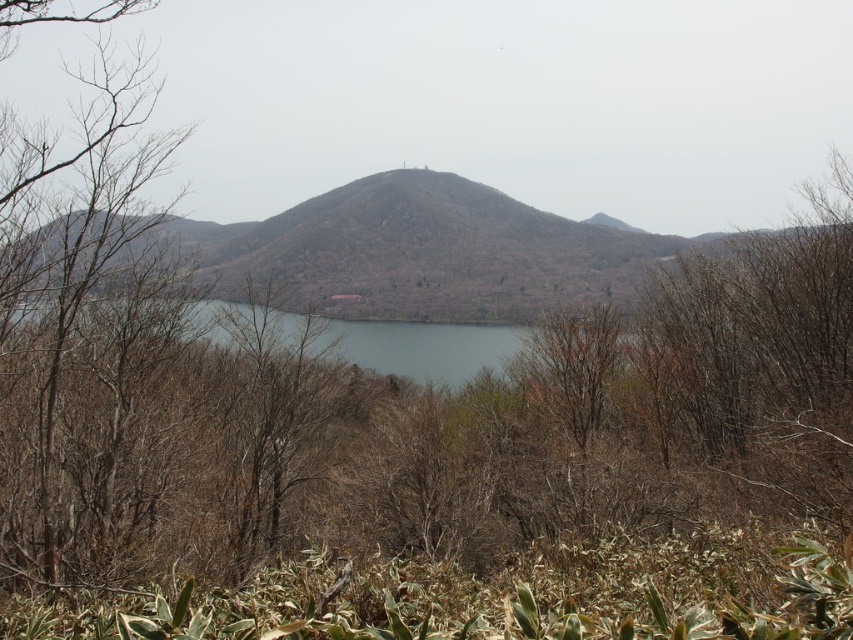
You are standing at the point closer to the viewer between point (x=345, y=269) and point (x=416, y=365). Which point are you at?

A: You are at point (x=416, y=365) because it is closer to the viewer than point (x=345, y=269).

You are standing at the edge of the water in the scene. Which direction should you walk to reach the brown textured hill at center?

You should walk towards the center of the scene to reach the brown textured hill at center, which is located at point coordinates (445, 250).